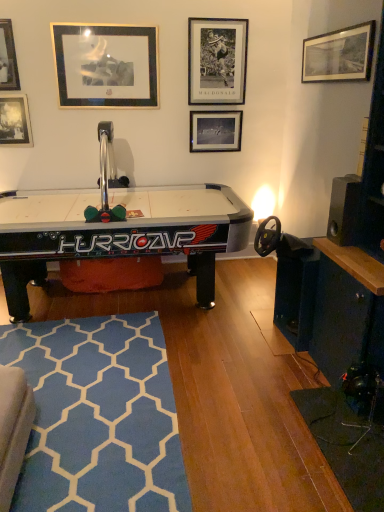
Question: Can you confirm if black matte picture frame at upper right, arranged as the first picture frame when viewed from the right, is positioned to the left of gold/metallic picture frame at upper left, the third picture frame from the left?

Choices:
 (A) no
 (B) yes

Answer: (A)

Question: Is black matte picture frame at upper right, arranged as the first picture frame when viewed from the right, with gold/metallic picture frame at upper left, which is the 4th picture frame in right-to-left order?

Choices:
 (A) yes
 (B) no

Answer: (B)

Question: Is the position of black matte picture frame at upper right, arranged as the 6th picture frame when viewed from the left, more distant than that of gold/metallic picture frame at upper left, which is the 4th picture frame in right-to-left order?

Choices:
 (A) no
 (B) yes

Answer: (A)

Question: From the image's perspective, is black matte picture frame at upper right, arranged as the 6th picture frame when viewed from the left, on top of gold/metallic picture frame at upper left, which is the 4th picture frame in right-to-left order?

Choices:
 (A) no
 (B) yes

Answer: (A)

Question: From a real-world perspective, is black matte picture frame at upper right, arranged as the 6th picture frame when viewed from the left, located higher than gold/metallic picture frame at upper left, which is the 4th picture frame in right-to-left order?

Choices:
 (A) yes
 (B) no

Answer: (A)

Question: Is black matte picture frame at upper right, arranged as the 6th picture frame when viewed from the left, looking in the opposite direction of gold/metallic picture frame at upper left, which is the 4th picture frame in right-to-left order?

Choices:
 (A) no
 (B) yes

Answer: (A)

Question: Can you see blue textured rug at lower left touching metallic silver picture frame at upper center, placed as the 2th picture frame when sorted from right to left?

Choices:
 (A) no
 (B) yes

Answer: (A)

Question: From the image's perspective, would you say blue textured rug at lower left is shown under metallic silver picture frame at upper center, placed as the 5th picture frame when sorted from left to right?

Choices:
 (A) yes
 (B) no

Answer: (A)

Question: Is metallic silver picture frame at upper center, placed as the 2th picture frame when sorted from right to left, surrounded by blue textured rug at lower left?

Choices:
 (A) yes
 (B) no

Answer: (B)

Question: Is blue textured rug at lower left to the left of metallic silver picture frame at upper center, placed as the 5th picture frame when sorted from left to right, from the viewer's perspective?

Choices:
 (A) yes
 (B) no

Answer: (A)

Question: Is blue textured rug at lower left to the right of metallic silver picture frame at upper center, placed as the 5th picture frame when sorted from left to right, from the viewer's perspective?

Choices:
 (A) no
 (B) yes

Answer: (A)

Question: Can you confirm if blue textured rug at lower left is taller than metallic silver picture frame at upper center, placed as the 5th picture frame when sorted from left to right?

Choices:
 (A) yes
 (B) no

Answer: (B)

Question: Considering the relative positions of black glossy air hockey table at center and black matte picture frame at center, marked as the fourth picture frame in a left-to-right arrangement, in the image provided, is black glossy air hockey table at center behind black matte picture frame at center, marked as the fourth picture frame in a left-to-right arrangement,?

Choices:
 (A) no
 (B) yes

Answer: (A)